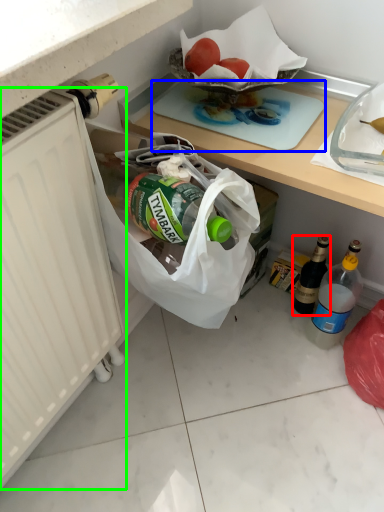
Question: Which is nearer to the bottle (highlighted by a red box)? cutting board (highlighted by a blue box) or radiator (highlighted by a green box).

Choices:
 (A) cutting board
 (B) radiator

Answer: (A)